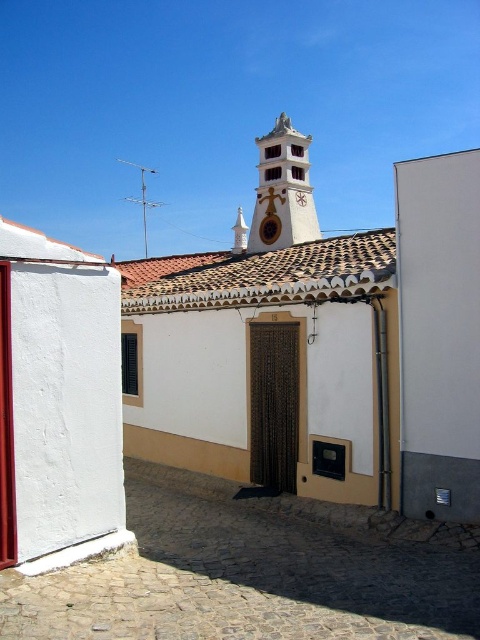
Question: Which object appears closest to the camera in this image?

Choices:
 (A) white painted wood clock tower at upper center
 (B) white textured church at center

Answer: (B)

Question: Is white textured church at center below white painted wood clock tower at upper center?

Choices:
 (A) yes
 (B) no

Answer: (A)

Question: Can you confirm if white textured church at center is positioned below white painted wood clock tower at upper center?

Choices:
 (A) no
 (B) yes

Answer: (B)

Question: Does white textured church at center have a greater width compared to white painted wood clock tower at upper center?

Choices:
 (A) yes
 (B) no

Answer: (A)